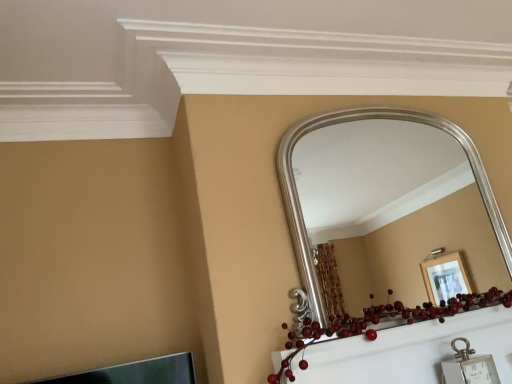
Question: From the image's perspective, is silver metallic mirror at upper center above shiny red berries at center?

Choices:
 (A) yes
 (B) no

Answer: (A)

Question: Considering the relative sizes of silver metallic mirror at upper center and shiny red berries at center in the image provided, is silver metallic mirror at upper center thinner than shiny red berries at center?

Choices:
 (A) no
 (B) yes

Answer: (B)

Question: Are silver metallic mirror at upper center and shiny red berries at center making contact?

Choices:
 (A) no
 (B) yes

Answer: (A)

Question: Considering the relative sizes of silver metallic mirror at upper center and shiny red berries at center in the image provided, is silver metallic mirror at upper center bigger than shiny red berries at center?

Choices:
 (A) no
 (B) yes

Answer: (A)

Question: From a real-world perspective, is silver metallic mirror at upper center positioned over shiny red berries at center based on gravity?

Choices:
 (A) yes
 (B) no

Answer: (A)

Question: From the image's perspective, is silver metallic mirror at upper center under shiny red berries at center?

Choices:
 (A) no
 (B) yes

Answer: (A)

Question: Is the surface of shiny red berries at center in direct contact with silver metallic mirror at upper center?

Choices:
 (A) yes
 (B) no

Answer: (B)

Question: Can you confirm if shiny red berries at center is positioned to the right of silver metallic mirror at upper center?

Choices:
 (A) yes
 (B) no

Answer: (B)

Question: From a real-world perspective, is shiny red berries at center below silver metallic mirror at upper center?

Choices:
 (A) yes
 (B) no

Answer: (A)

Question: From the image's perspective, would you say shiny red berries at center is positioned over silver metallic mirror at upper center?

Choices:
 (A) no
 (B) yes

Answer: (A)

Question: Is shiny red berries at center thinner than silver metallic mirror at upper center?

Choices:
 (A) no
 (B) yes

Answer: (A)

Question: Is shiny red berries at center smaller than silver metallic mirror at upper center?

Choices:
 (A) yes
 (B) no

Answer: (B)

Question: Is silver metallic mirror at upper center bigger or smaller than shiny red berries at center?

Choices:
 (A) big
 (B) small

Answer: (B)